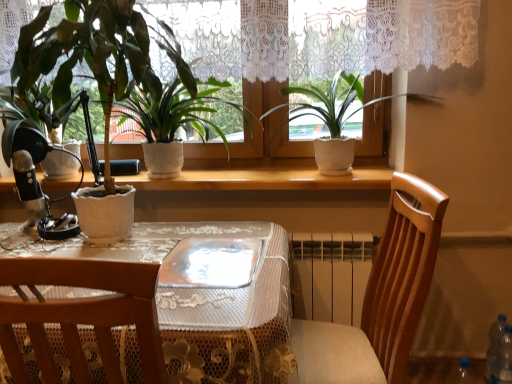
Identify the location of free space behind transparent glass plate at center. (211, 233).